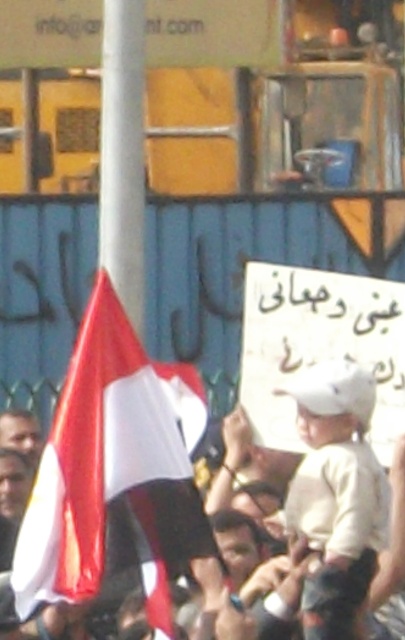
You are a photographer trying to capture a clear shot of both the white fabric flag at center and the white paper placard at center. Since they are both in the center, which object should you focus on first to ensure it appears larger in your photo?

The white fabric flag at center is taller than the white paper placard at center, so focusing on the white fabric flag at center first will ensure it appears larger in the photo.

Looking at this image, you are a photographer standing at the event. You want to take a closeup shot of the white paper placard at center. Given that your camera can focus on objects within 200 feet, will you be able to capture a clear image of the placard?

The white paper placard at center is 203.14 feet away from the viewer, which is beyond the camera focus range of 200 feet. Therefore, the photographer cannot capture a clear image of the placard.